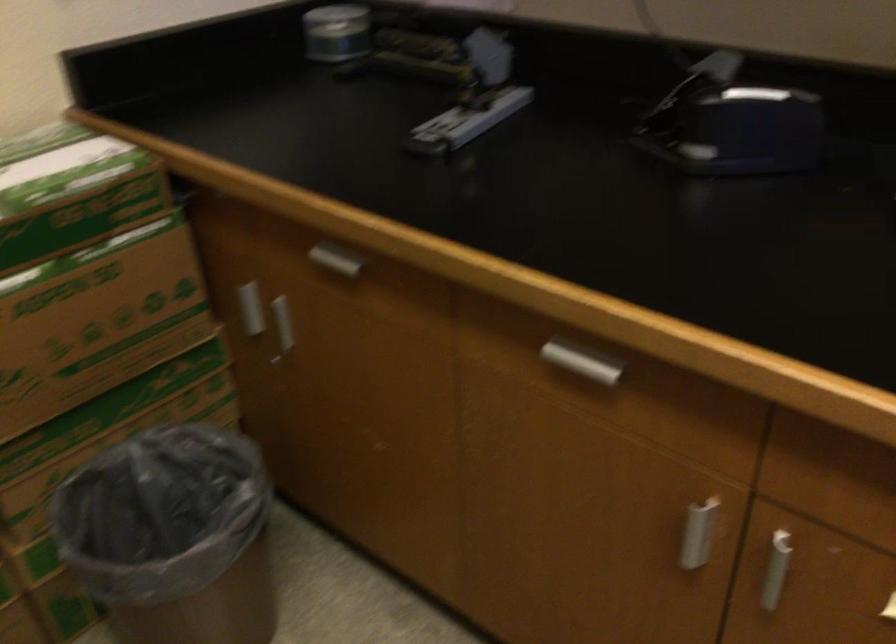
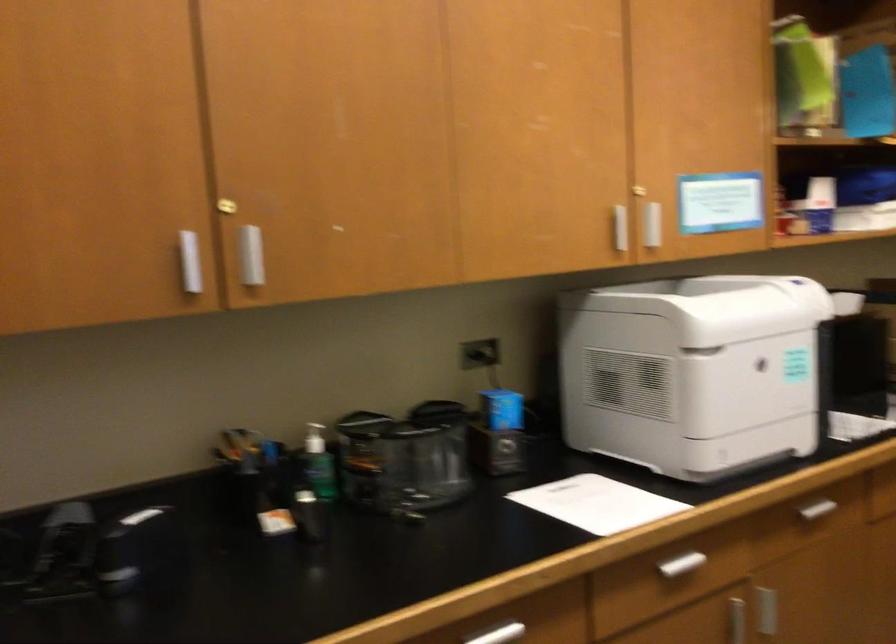
Question: How did the camera likely rotate?

Choices:
 (A) Left
 (B) Right
 (C) Up
 (D) Down

Answer: (B)